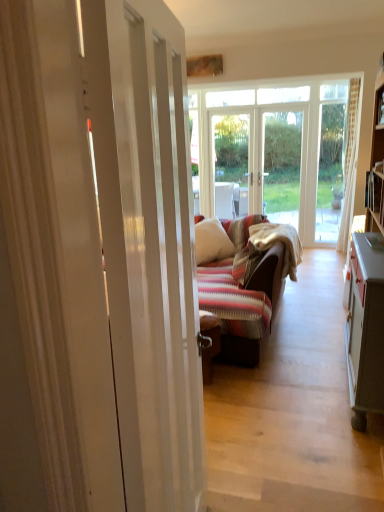
This screenshot has height=512, width=384. What are the coordinates of `white glossy door at center` in the screenshot? It's located at (154, 261).

What do you see at coordinates (154, 261) in the screenshot? I see `white glossy door at center` at bounding box center [154, 261].

What is the approximate height of white soft pillow at center?

23.72 inches.

Describe the element at coordinates (211, 241) in the screenshot. The height and width of the screenshot is (512, 384). I see `white soft pillow at center` at that location.

This screenshot has width=384, height=512. I want to click on white soft pillow at center, so click(211, 241).

What are the coordinates of `white glossy door at center` in the screenshot? It's located at (154, 261).

Based on their positions, is white glossy door at center located to the left or right of white soft pillow at center?

white glossy door at center is positioned on white soft pillow at center's left side.

Which object is more forward, white glossy door at center or white soft pillow at center?

white glossy door at center is more forward.

Considering the positions of points (153, 338) and (205, 236), is point (153, 338) closer to camera compared to point (205, 236)?

Yes, point (153, 338) is in front of point (205, 236).

From the image's perspective, is white glossy door at center above white soft pillow at center?

No, from the image's perspective, white glossy door at center is not over white soft pillow at center.

From a real-world perspective, is white glossy door at center on white soft pillow at center?

Yes, from a real-world perspective, white glossy door at center is above white soft pillow at center.

Considering the relative sizes of white glossy door at center and white soft pillow at center in the image provided, is white glossy door at center wider than white soft pillow at center?

No, white glossy door at center is not wider than white soft pillow at center.

Who is taller, white glossy door at center or white soft pillow at center?

white glossy door at center is taller.

Which of these two, white glossy door at center or white soft pillow at center, is bigger?

white glossy door at center is bigger.

From the picture: Is white glossy door at center not within white soft pillow at center?

Yes, white glossy door at center is not within white soft pillow at center.

Are white glossy door at center and white soft pillow at center making contact?

There is a gap between white glossy door at center and white soft pillow at center.

Is white glossy door at center turned away from white soft pillow at center?

No.

How many degrees apart are the facing directions of white glossy door at center and white soft pillow at center?

There is a 74.7-degree angle between the facing directions of white glossy door at center and white soft pillow at center.

You are a GUI agent. You are given a task and a screenshot of the screen. Output one action in this format:
    pyautogui.click(x=<x>, y=<y>)
    Task: Click on the pillow behind the white glossy door at center
    The height and width of the screenshot is (512, 384).
    Given the screenshot: What is the action you would take?
    pyautogui.click(x=211, y=241)

Considering the positions of objects white soft pillow at center and white glossy door at center in the image provided, who is more to the right, white soft pillow at center or white glossy door at center?

white soft pillow at center is more to the right.

Which object is further away from the camera taking this photo, white soft pillow at center or white glossy door at center?

white soft pillow at center is behind.

Considering the positions of points (198, 256) and (162, 135), is point (198, 256) closer to camera compared to point (162, 135)?

No, it is behind (162, 135).

From the image's perspective, is white soft pillow at center above white glossy door at center?

Yes.

From a real-world perspective, relative to white glossy door at center, is white soft pillow at center vertically above or below?

white soft pillow at center is situated lower than white glossy door at center in the real world.

Considering the sizes of objects white soft pillow at center and white glossy door at center in the image provided, who is wider, white soft pillow at center or white glossy door at center?

white soft pillow at center.

Considering the relative sizes of white soft pillow at center and white glossy door at center in the image provided, is white soft pillow at center taller than white glossy door at center?

In fact, white soft pillow at center may be shorter than white glossy door at center.

Considering the relative sizes of white soft pillow at center and white glossy door at center in the image provided, is white soft pillow at center bigger than white glossy door at center?

Incorrect, white soft pillow at center is not larger than white glossy door at center.

Would you say white soft pillow at center is inside or outside white glossy door at center?

white soft pillow at center cannot be found inside white glossy door at center.

Is white soft pillow at center positioned far away from white glossy door at center?

Indeed, white soft pillow at center is not near white glossy door at center.

Does white soft pillow at center turn towards white glossy door at center?

Yes, white soft pillow at center is facing white glossy door at center.

How far apart are white soft pillow at center and white glossy door at center?

white soft pillow at center and white glossy door at center are 2.91 meters apart.

I want to click on pillow above the white glossy door at center (from the image's perspective), so click(211, 241).

Image resolution: width=384 pixels, height=512 pixels. I want to click on pillow to the right of white glossy door at center, so click(x=211, y=241).

You are a GUI agent. You are given a task and a screenshot of the screen. Output one action in this format:
    pyautogui.click(x=<x>, y=<y>)
    Task: Click on the pillow above the white glossy door at center (from the image's perspective)
    
    Given the screenshot: What is the action you would take?
    pyautogui.click(x=211, y=241)